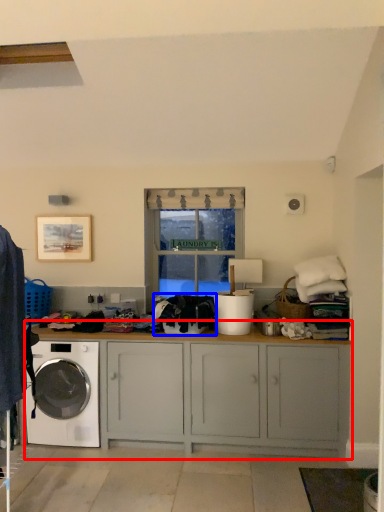
Question: Which object appears closest to the camera in this image, cabinetry (highlighted by a red box) or clothing (highlighted by a blue box)?

Choices:
 (A) cabinetry
 (B) clothing

Answer: (A)